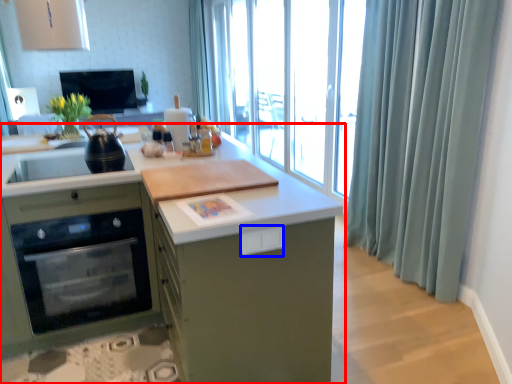
Question: Which point is further to the camera, cabinetry (highlighted by a red box) or drawer (highlighted by a blue box)?

Choices:
 (A) cabinetry
 (B) drawer

Answer: (B)